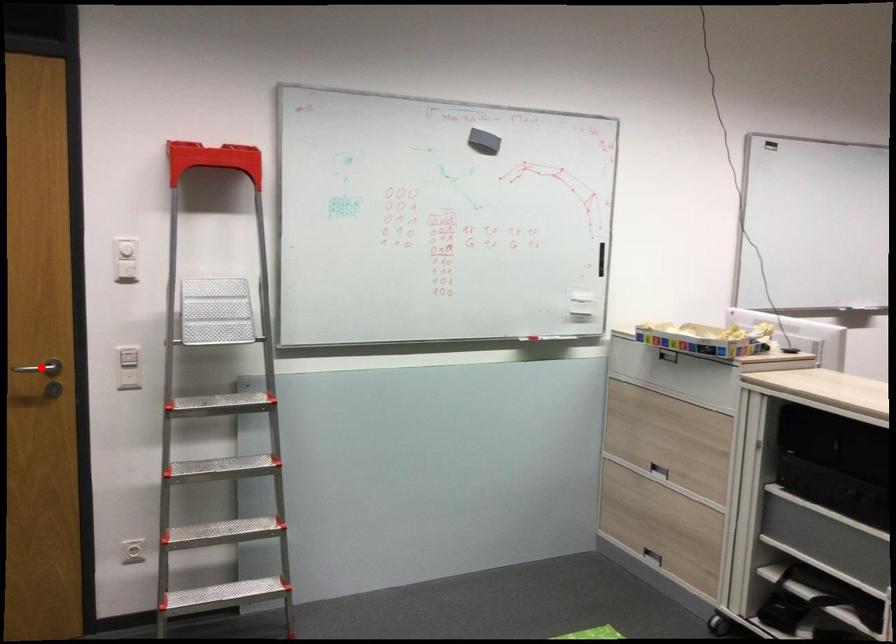
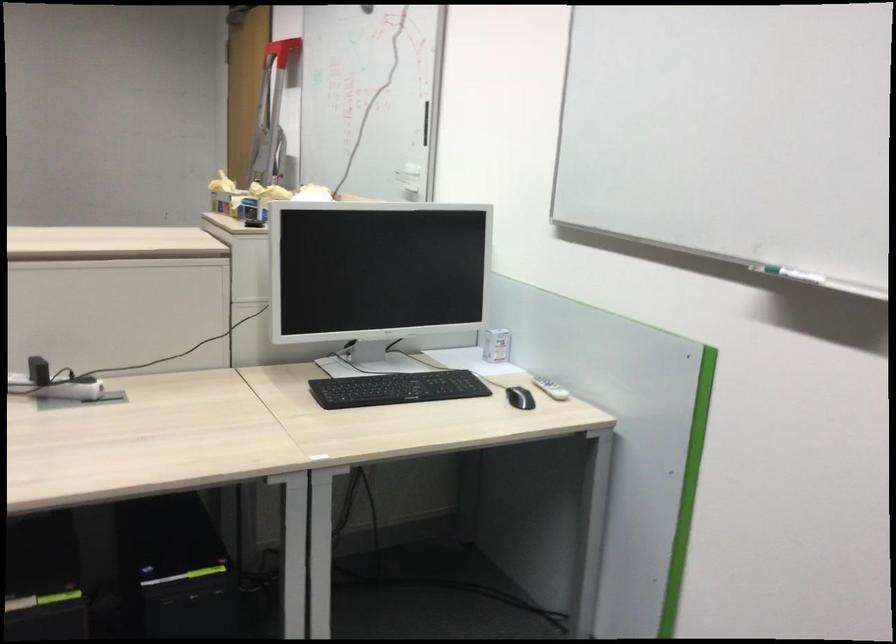
Question: I am providing you with two images of the same scene from different viewpoints. A red point is marked on the first image. Is the red point's position out of view in image 2?

Choices:
 (A) Yes
 (B) No

Answer: (A)